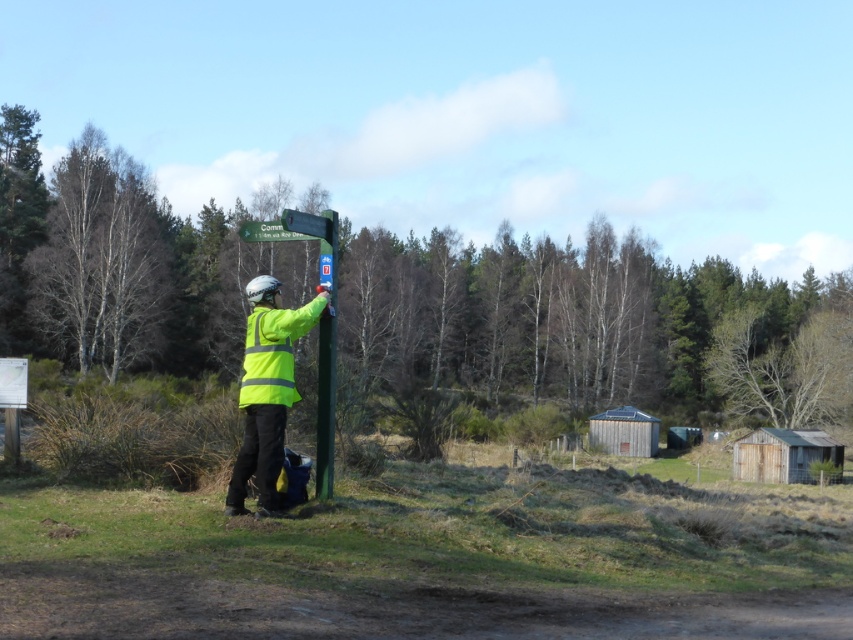
You are standing at the point closer to the camera between the two points, point (643, 301) and point (322, 225). Which point are you standing at?

You are standing at point (643, 301) because it is further to the camera than point (322, 225).

You are a park ranger checking the layout of the park. You notice the bare wood tree at left and the green plastic sign at upper center. Which object is wider?

The bare wood tree at left is wider than the green plastic sign at upper center.